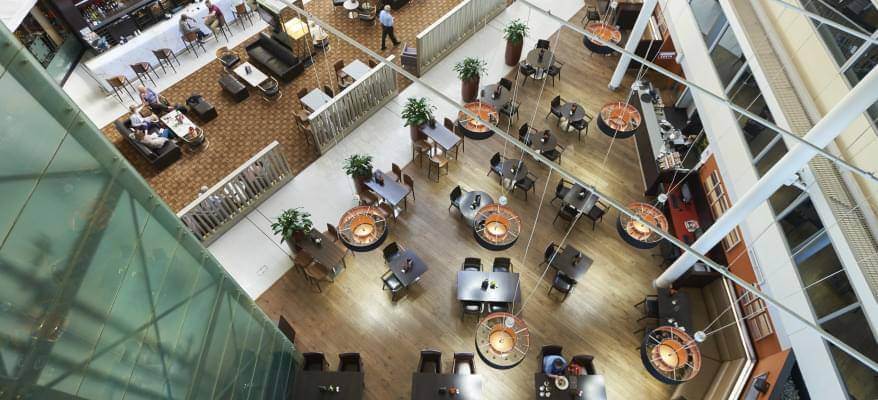
Identify the location of bar stools. (114, 81), (140, 66), (162, 53), (188, 36), (218, 25), (242, 11).